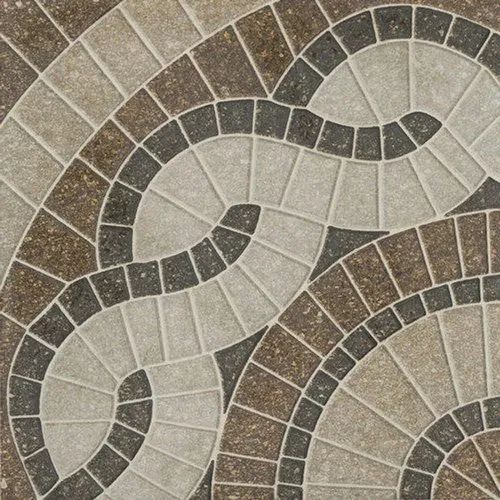
Find the location of a particular element. The height and width of the screenshot is (500, 500). curved grout line segments is located at coordinates (392, 41), (390, 4).